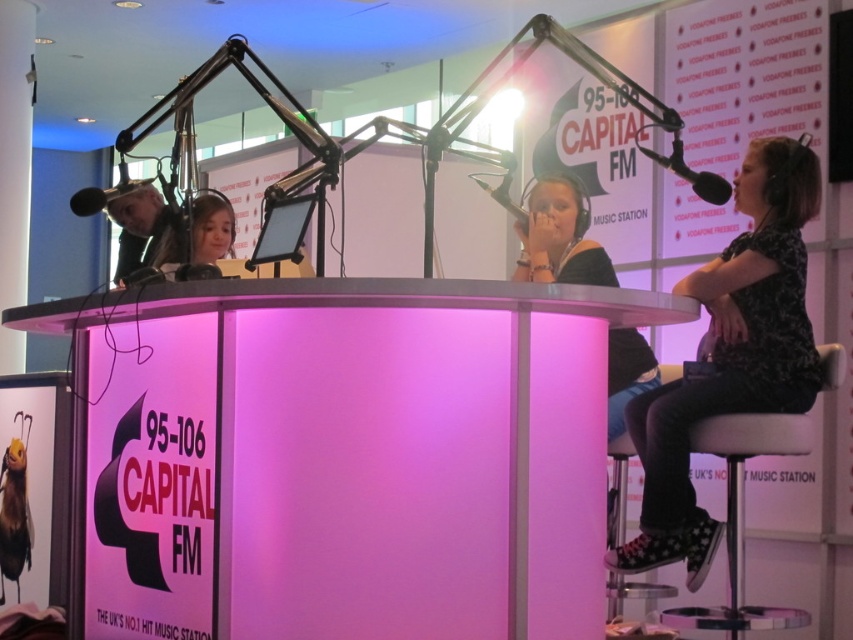
You are a guest at the Capital FM radio station and need to sit between the matte black shirt at center and the metallic silver microphone at upper center. Which side of the microphone should you sit on?

You should sit to the right side of the metallic silver microphone at upper center because the matte black shirt at center is positioned on the right side of the microphone, so sitting there places you between them.

You are a technician adjusting the microphone positions for the Capital FM broadcast. The matte black shirt at center belongs to the lead host who needs to reach the black matte microphone at upper right without leaving their seat. Can they comfortably reach it if their arm span is 70 centimeters?

The distance between the matte black shirt at center and the black matte microphone at upper right is 66.17 centimeters. Since the host has an arm span of 70 centimeters, they can comfortably reach the microphone.

You are a guest at the Capital FM radio station. You need to adjust your microphone to ensure it is directly above your shirt. Which object should you move, the matte black shirt at center or the black matte microphone at upper right?

The matte black shirt at center is positioned under the black matte microphone at upper right. To have the microphone directly above the shirt, you should adjust the black matte microphone at upper right to lower it or move the matte black shirt at center upwards.